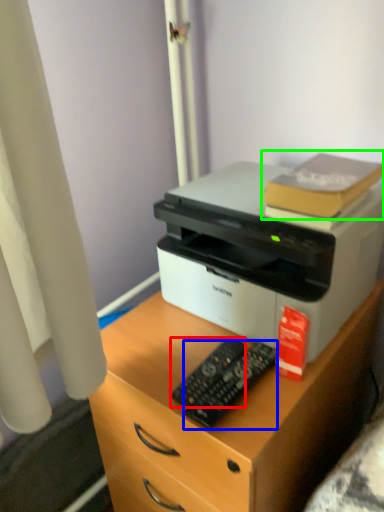
Question: Based on their relative distances, which object is farther from control (highlighted by a red box)? Choose from control (highlighted by a blue box) and book (highlighted by a green box).

Choices:
 (A) control
 (B) book

Answer: (B)